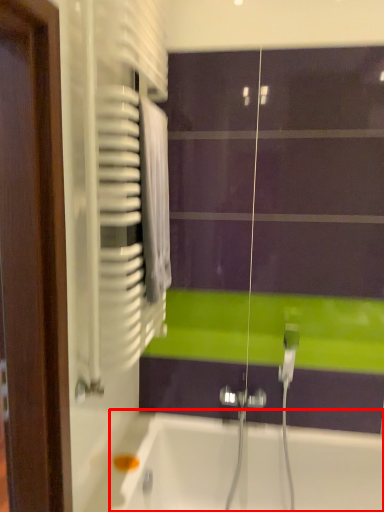
Question: Considering the relative positions of bathtub (annotated by the red box) and screen door in the image provided, where is bathtub (annotated by the red box) located with respect to the staircase?

Choices:
 (A) left
 (B) right

Answer: (B)